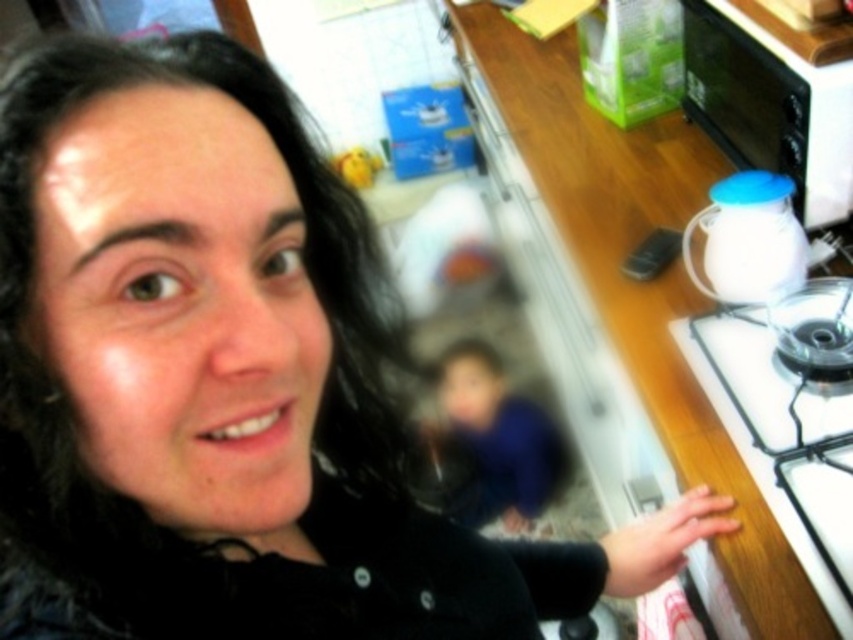
Which is more to the left, white glossy gas stove at right or white glossy oven at upper right?

From the viewer's perspective, white glossy gas stove at right appears more on the left side.

Can you confirm if white glossy gas stove at right is positioned to the right of white glossy oven at upper right?

No, white glossy gas stove at right is not to the right of white glossy oven at upper right.

Who is more forward, (828, 301) or (814, 100)?

Point (814, 100) is more forward.

You are a GUI agent. You are given a task and a screenshot of the screen. Output one action in this format:
    pyautogui.click(x=<x>, y=<y>)
    Task: Click on the white glossy gas stove at right
    Image resolution: width=853 pixels, height=640 pixels.
    Given the screenshot: What is the action you would take?
    pyautogui.click(x=787, y=422)

Who is positioned more to the left, wooden at upper right or blue fabric at center?

From the viewer's perspective, blue fabric at center appears more on the left side.

Can you confirm if wooden at upper right is positioned below blue fabric at center?

No.

Who is more distant from viewer, (x=579, y=104) or (x=482, y=408)?

The point (x=482, y=408) is more distant.

The width and height of the screenshot is (853, 640). Find the location of `wooden at upper right`. wooden at upper right is located at coordinates (639, 282).

Who is lower down, wooden at upper right or white glossy gas stove at right?

white glossy gas stove at right is lower down.

Which of these two, wooden at upper right or white glossy gas stove at right, stands shorter?

white glossy gas stove at right

Is point (747, 481) positioned behind point (825, 602)?

Yes.

Identify the location of wooden at upper right. (639, 282).